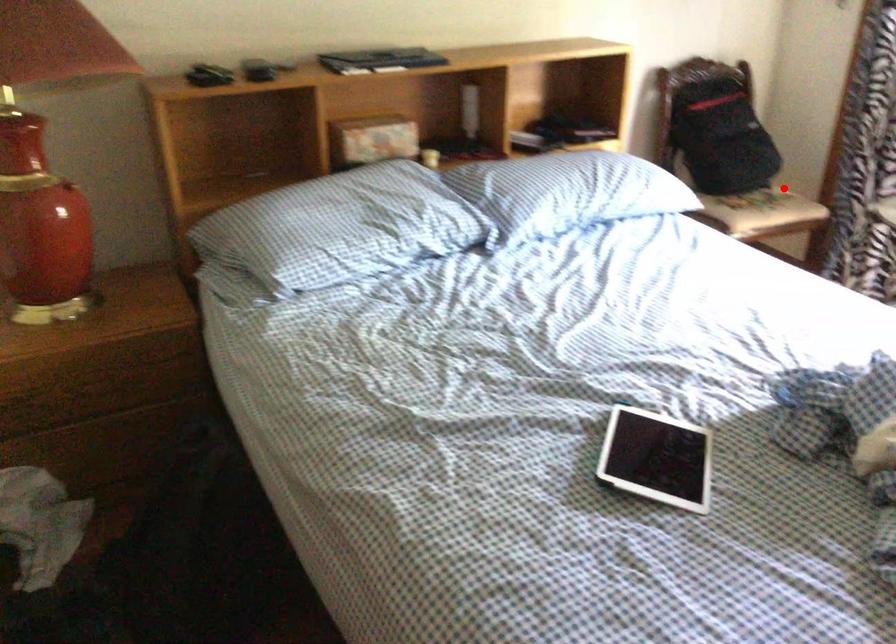
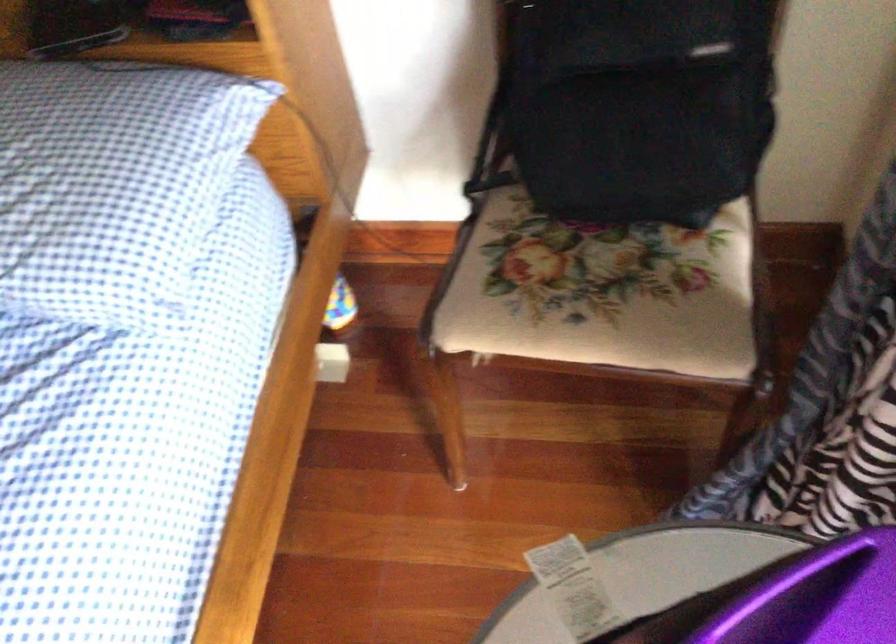
Question: I am providing you with two images of the same scene from different viewpoints. Given a red point in image1, look at the same physical point in image2. Is it:

Choices:
 (A) Closer to the viewpoint
 (B) Farther from the viewpoint

Answer: (A)